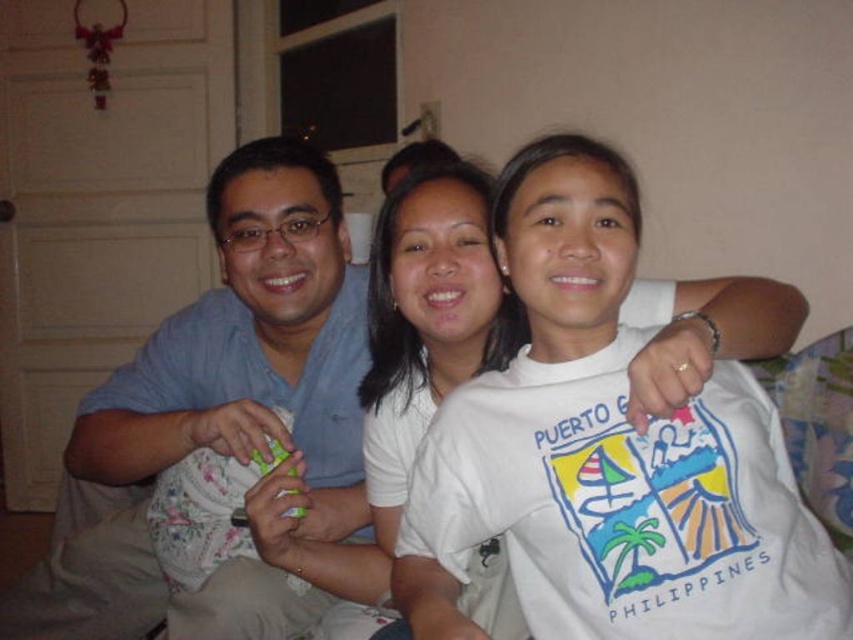
Question: Does light blue cotton shirt at left have a larger size compared to white cotton shirt at center?

Choices:
 (A) no
 (B) yes

Answer: (B)

Question: Can you confirm if light blue cotton shirt at left is wider than white cotton shirt at center?

Choices:
 (A) no
 (B) yes

Answer: (B)

Question: From the image, what is the correct spatial relationship of light blue cotton shirt at left in relation to white cotton shirt at center?

Choices:
 (A) above
 (B) below

Answer: (B)

Question: Which point is farther from the camera taking this photo?

Choices:
 (A) (357, 419)
 (B) (370, 570)

Answer: (A)

Question: Which object appears closest to the camera in this image?

Choices:
 (A) white cotton shirt at center
 (B) light blue cotton shirt at left

Answer: (A)